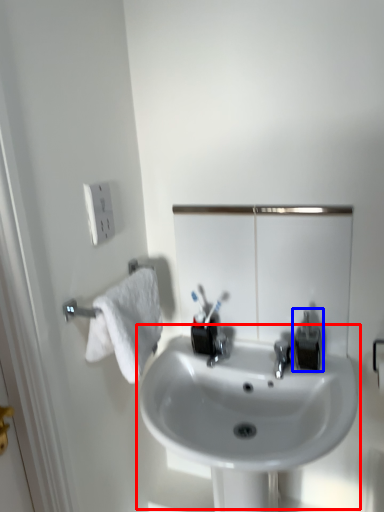
Question: Which of the following is the farthest to the observer, sink (highlighted by a red box) or plumbing fixture (highlighted by a blue box)?

Choices:
 (A) sink
 (B) plumbing fixture

Answer: (B)